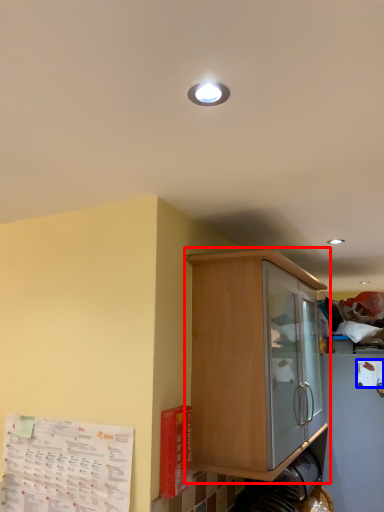
Question: Which object appears closest to the camera in this image, cabinetry (highlighted by a red box) or paper (highlighted by a blue box)?

Choices:
 (A) cabinetry
 (B) paper

Answer: (A)